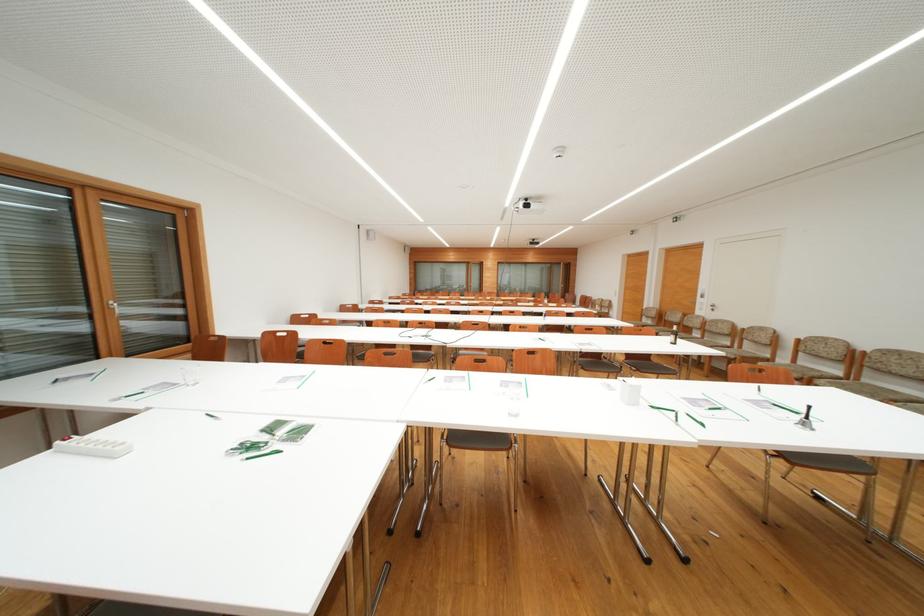
You are a GUI agent. You are given a task and a screenshot of the screen. Output one action in this format:
    pyautogui.click(x=<x>, y=<y>)
    Task: Click on the wall light switch
    This screenshot has height=616, width=924.
    Given the screenshot: What is the action you would take?
    pyautogui.click(x=776, y=464)